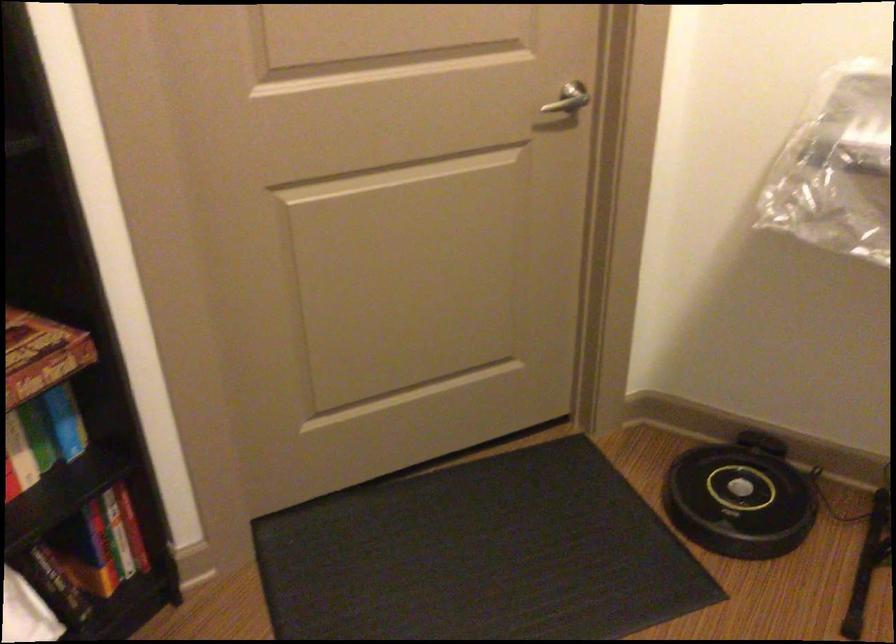
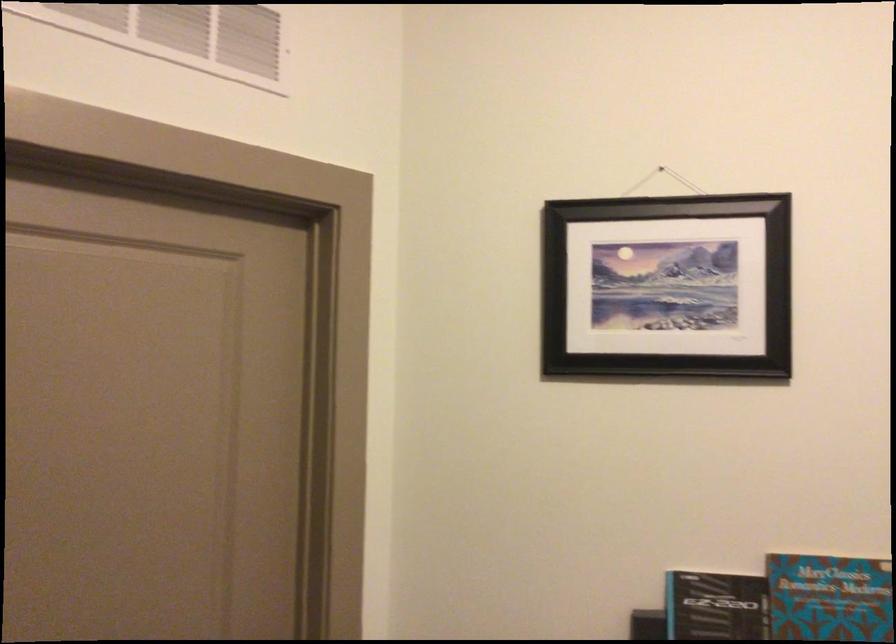
Based on the continuous images, in which direction is the camera rotating?

The rotation direction of the camera is right-up.